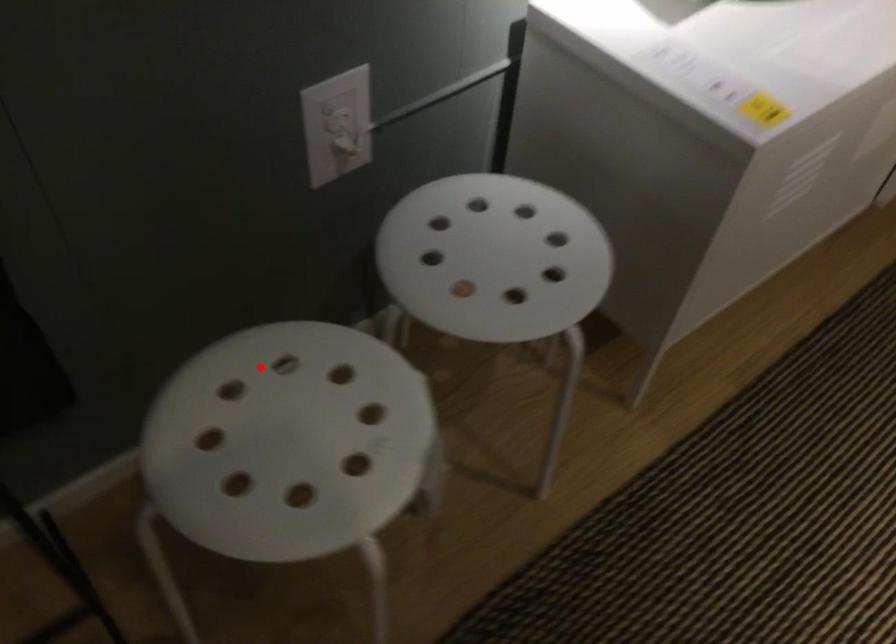
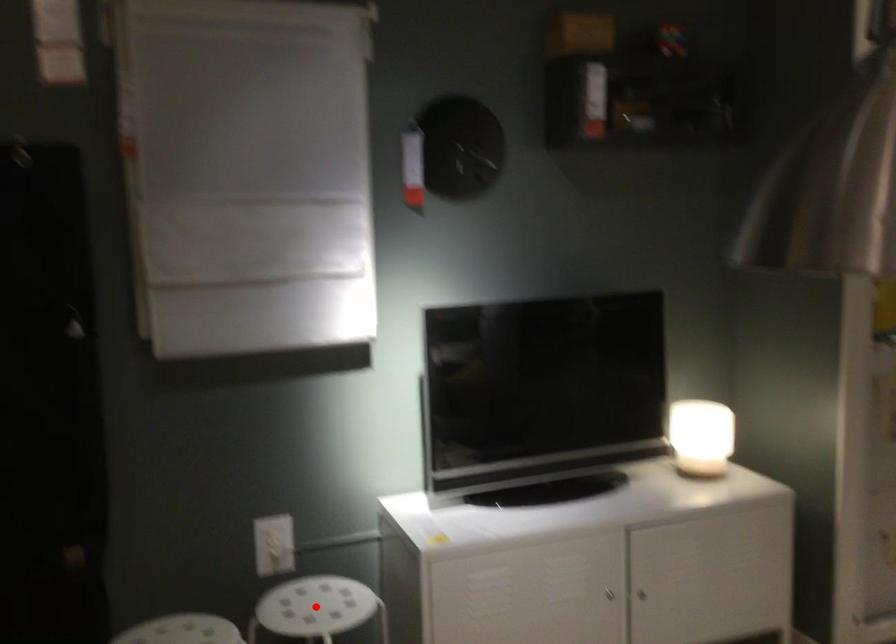
From the picture: I am providing you with two images of the same scene from different viewpoints. A red point is marked on the first image and another point is marked on the second image. Is the marked point in image1 the same physical position as the marked point in image2?

No